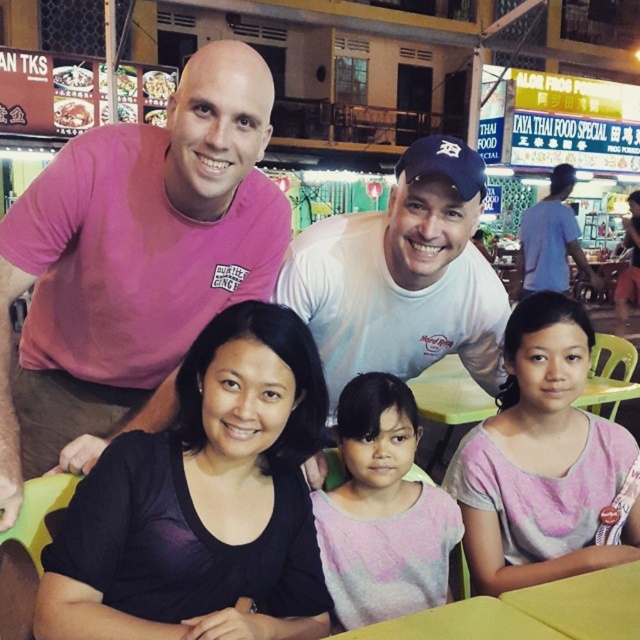
You are a photographer trying to capture a group photo of the blue cotton shirt at upper right and the matte brown rice at upper left. Which object should you focus on first if you want to ensure both are in focus, considering their sizes?

The blue cotton shirt at upper right is bigger than the matte brown rice at upper left, so you should focus on the blue cotton shirt at upper right first to ensure both are in focus.

You are a photographer standing at the center of the food court. You need to take a photo of the pink cotton shirt at lower right and the matte brown rice at upper left. Which object is farther from your current position?

The pink cotton shirt at lower right is 13.15 meters away from the matte brown rice at upper left. Since you are standing at the center, the distance between the two objects is 13.15 meters, but it does not specify which is farther from your position. Therefore, it is impossible to determine which object is farther based on the given information.